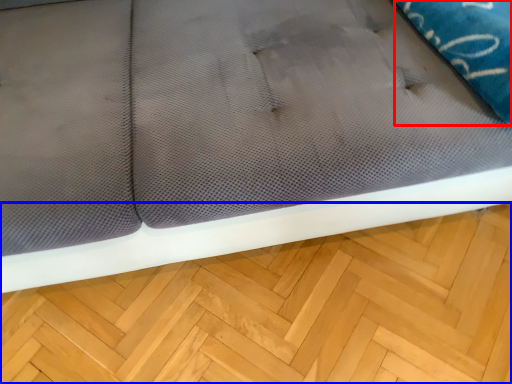
Question: Which object is closer to the camera taking this photo, pillow (highlighted by a red box) or hardwood (highlighted by a blue box)?

Choices:
 (A) pillow
 (B) hardwood

Answer: (A)